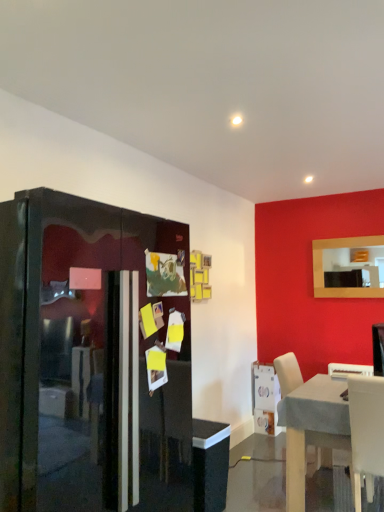
This screenshot has height=512, width=384. Find the location of `glossy black fridge at left`. glossy black fridge at left is located at coordinates (90, 359).

In order to face white plastic chair at lower right, which appears as the first chair when viewed from the back, should I rotate leftwards or rightwards?

Rotate your view right by about 19.955°.

The height and width of the screenshot is (512, 384). Find the location of `white plastic chair at lower right, the second chair positioned from the top`. white plastic chair at lower right, the second chair positioned from the top is located at coordinates (366, 432).

This screenshot has width=384, height=512. Describe the element at coordinates (366, 432) in the screenshot. I see `white plastic chair at lower right, the first chair viewed from the front` at that location.

This screenshot has height=512, width=384. I want to click on glossy black fridge at left, so point(90,359).

Is glossy black fridge at left completely or partially inside light wood table at lower right?

No, light wood table at lower right does not contain glossy black fridge at left.

Considering the positions of objects light wood table at lower right and glossy black fridge at left in the image provided, who is more to the left, light wood table at lower right or glossy black fridge at left?

glossy black fridge at left is more to the left.

Is light wood table at lower right turned away from glossy black fridge at left?

That's not correct — light wood table at lower right is not looking away from glossy black fridge at left.

How different are the orientations of light wood table at lower right and glossy black fridge at left in degrees?

light wood table at lower right and glossy black fridge at left are facing 0.858 degrees away from each other.

Does white plastic chair at lower right, which is the second chair from front to back, turn towards white plastic chair at lower right, which is the second chair in back-to-front order?

No, white plastic chair at lower right, which is the second chair from front to back, is not turned towards white plastic chair at lower right, which is the second chair in back-to-front order.

From a real-world perspective, between white plastic chair at lower right, which appears as the first chair when viewed from the back, and white plastic chair at lower right, the second chair positioned from the top, who is vertically higher?

From a 3D spatial view, white plastic chair at lower right, which appears as the first chair when viewed from the back, is above.

From the image's perspective, is white plastic chair at lower right, which appears as the second chair when ordered from the bottom, beneath white plastic chair at lower right, the first chair viewed from the front?

No, from the image's perspective, white plastic chair at lower right, which appears as the second chair when ordered from the bottom, is not below white plastic chair at lower right, the first chair viewed from the front.

Does white plastic chair at lower right, marked as the 1th chair in a top-to-bottom arrangement, appear on the right side of white plastic chair at lower right, acting as the first chair starting from the bottom?

Yes, white plastic chair at lower right, marked as the 1th chair in a top-to-bottom arrangement, is to the right of white plastic chair at lower right, acting as the first chair starting from the bottom.

From the picture: Which of these two, white glossy microwave at lower right or white plastic chair at lower right, the first chair viewed from the front, is wider?

white plastic chair at lower right, the first chair viewed from the front, is wider.

Does white glossy microwave at lower right contain white plastic chair at lower right, which is the second chair in back-to-front order?

No, white plastic chair at lower right, which is the second chair in back-to-front order, is not a part of white glossy microwave at lower right.

In the image, there is a white plastic chair at lower right, which is the second chair in back-to-front order. Where is `appliance below it (from the image's perspective)`? The image size is (384, 512). appliance below it (from the image's perspective) is located at coordinates (x=265, y=399).

Could you tell me if white glossy microwave at lower right is turned towards white plastic chair at lower right, acting as the first chair starting from the bottom?

No, white glossy microwave at lower right does not turn towards white plastic chair at lower right, acting as the first chair starting from the bottom.

Is white plastic chair at lower right, which is the second chair in back-to-front order, at the back of glossy black fridge at left?

No.

Considering the points (78, 371) and (362, 420), which point is in front, point (78, 371) or point (362, 420)?

Positioned in front is point (78, 371).

Find the location of a particular element. The height and width of the screenshot is (512, 384). the 1st chair behind the glossy black fridge at left, starting your count from the anchor is located at coordinates (366, 432).

From a real-world perspective, which object stands above the other?

From a 3D spatial view, light wood table at lower right is above.

Who is taller, light wood table at lower right or white glossy microwave at lower right?

light wood table at lower right.

Considering the relative sizes of light wood table at lower right and white glossy microwave at lower right in the image provided, is light wood table at lower right thinner than white glossy microwave at lower right?

In fact, light wood table at lower right might be wider than white glossy microwave at lower right.

In order to click on table above the white glossy microwave at lower right (from the image's perspective) in this screenshot , I will do `click(311, 428)`.

Between light wood table at lower right and matte wooden mirror at upper right, which one has less height?

matte wooden mirror at upper right is shorter.

From the image's perspective, which one is positioned higher, light wood table at lower right or matte wooden mirror at upper right?

matte wooden mirror at upper right is shown above in the image.

Between light wood table at lower right and matte wooden mirror at upper right, which one has smaller width?

matte wooden mirror at upper right.

At what (x,y) coordinates should I click in order to perform the action: click on table that appears below the matte wooden mirror at upper right (from the image's perspective). Please return your answer as a coordinate pair (x, y). The width and height of the screenshot is (384, 512). Looking at the image, I should click on (311, 428).

From a real-world perspective, relative to white glossy microwave at lower right, is matte wooden mirror at upper right vertically above or below?

matte wooden mirror at upper right is situated higher than white glossy microwave at lower right in the real world.

Considering the sizes of objects matte wooden mirror at upper right and white glossy microwave at lower right in the image provided, who is thinner, matte wooden mirror at upper right or white glossy microwave at lower right?

With smaller width is matte wooden mirror at upper right.

Is matte wooden mirror at upper right aimed at white glossy microwave at lower right?

No, matte wooden mirror at upper right is not aimed at white glossy microwave at lower right.

Find the location of a particular element. The image size is (384, 512). fridge on the left of light wood table at lower right is located at coordinates (90, 359).

I want to click on chair that is in front of the white plastic chair at lower right, which appears as the second chair when ordered from the bottom, so click(x=366, y=432).

Estimate the real-world distances between objects in this image. Which object is further from white glossy microwave at lower right, glossy black fridge at left or white plastic chair at lower right, the second chair positioned from the top?

glossy black fridge at left is further to white glossy microwave at lower right.

Based on their spatial positions, is white plastic chair at lower right, which appears as the first chair when viewed from the back, or glossy black fridge at left closer to matte wooden mirror at upper right?

The object closer to matte wooden mirror at upper right is white plastic chair at lower right, which appears as the first chair when viewed from the back.

Looking at the image, which one is located closer to white plastic chair at lower right, the second chair positioned from the top, light wood table at lower right or matte wooden mirror at upper right?

light wood table at lower right is positioned closer to the anchor white plastic chair at lower right, the second chair positioned from the top.

When comparing their distances from matte wooden mirror at upper right, does glossy black fridge at left or white plastic chair at lower right, which appears as the second chair when ordered from the bottom, seem further?

The object further to matte wooden mirror at upper right is glossy black fridge at left.

In the scene shown: Which object lies nearer to the anchor point white plastic chair at lower right, acting as the first chair starting from the bottom, light wood table at lower right or white glossy microwave at lower right?

Based on the image, light wood table at lower right appears to be nearer to white plastic chair at lower right, acting as the first chair starting from the bottom.

Based on their spatial positions, is matte wooden mirror at upper right or glossy black fridge at left further from white plastic chair at lower right, which is the second chair from front to back?

glossy black fridge at left is positioned further to the anchor white plastic chair at lower right, which is the second chair from front to back.

Based on their spatial positions, is glossy black fridge at left or white glossy microwave at lower right closer to light wood table at lower right?

Among the two, white glossy microwave at lower right is located nearer to light wood table at lower right.

Estimate the real-world distances between objects in this image. Which object is further from matte wooden mirror at upper right, light wood table at lower right or white plastic chair at lower right, which appears as the first chair when viewed from the back?

The object further to matte wooden mirror at upper right is light wood table at lower right.

Locate an element on the screen. The image size is (384, 512). table between glossy black fridge at left and white plastic chair at lower right, which appears as the second chair when ordered from the bottom, in the front-back direction is located at coordinates (311, 428).

This screenshot has width=384, height=512. I want to click on table between glossy black fridge at left and white glossy microwave at lower right in the front-back direction, so click(311, 428).

Find the location of a particular element. The image size is (384, 512). mirror between white plastic chair at lower right, the second chair positioned from the top, and white glossy microwave at lower right from front to back is located at coordinates (345, 265).

The width and height of the screenshot is (384, 512). Identify the location of chair positioned between light wood table at lower right and matte wooden mirror at upper right from near to far. (349, 370).